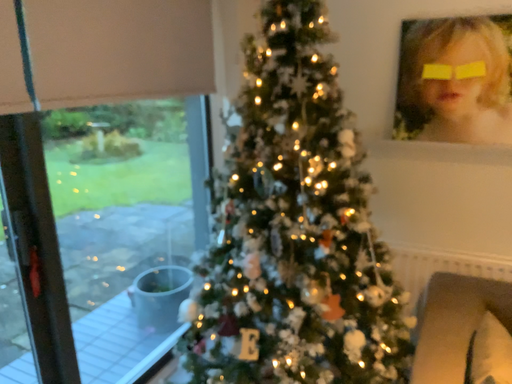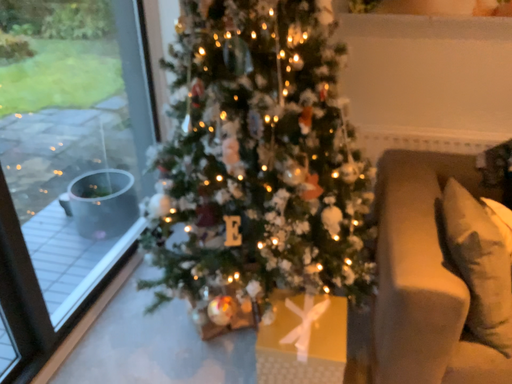
Question: How did the camera likely rotate when shooting the video?

Choices:
 (A) rotated upward
 (B) rotated downward

Answer: (B)